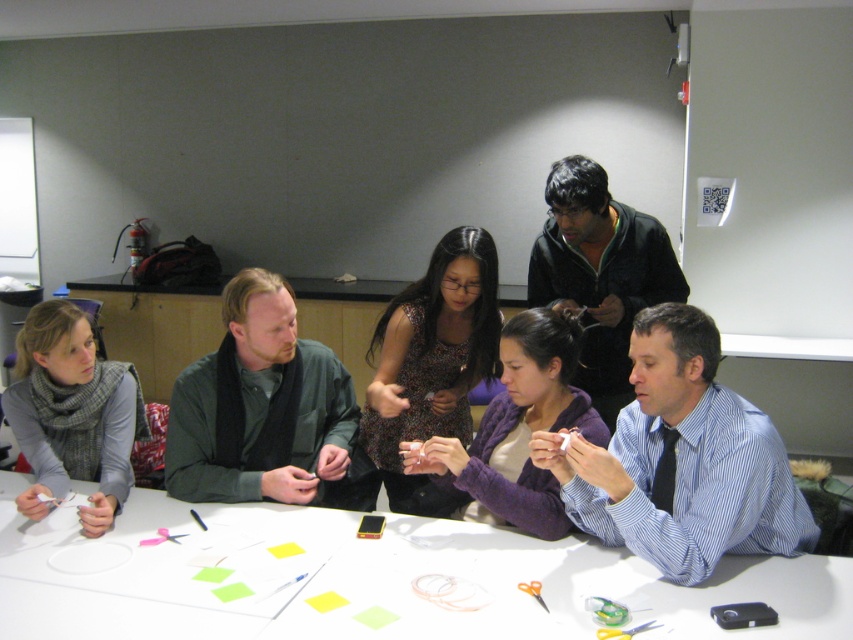
Question: Where is white paper at center located in relation to green matte jacket at center in the image?

Choices:
 (A) left
 (B) right

Answer: (B)

Question: Can you confirm if white paper at center is positioned below gray wool scarf at left?

Choices:
 (A) yes
 (B) no

Answer: (A)

Question: Among these objects, which one is farthest from the camera?

Choices:
 (A) blue striped shirt at center
 (B) purple fleece sweater at center
 (C) dark green sweater at upper center
 (D) gray wool scarf at left

Answer: (C)

Question: Which is nearer to the green matte jacket at center?

Choices:
 (A) blue striped shirt at center
 (B) purple fleece sweater at center

Answer: (B)

Question: Is patterned fabric dress at center bigger than purple fleece sweater at center?

Choices:
 (A) yes
 (B) no

Answer: (A)

Question: Estimate the real-world distances between objects in this image. Which object is farther from the gray wool scarf at left?

Choices:
 (A) purple fleece sweater at center
 (B) patterned fabric dress at center

Answer: (A)